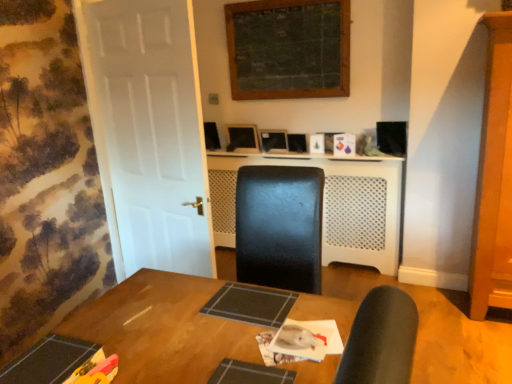
Question: From the image's perspective, is white perforated plastic at center under matte black monitor at center?

Choices:
 (A) yes
 (B) no

Answer: (A)

Question: From the image's perspective, is white perforated plastic at center on top of matte black monitor at center?

Choices:
 (A) yes
 (B) no

Answer: (B)

Question: Does white perforated plastic at center contain matte black monitor at center?

Choices:
 (A) no
 (B) yes

Answer: (A)

Question: Can you confirm if white perforated plastic at center is thinner than matte black monitor at center?

Choices:
 (A) yes
 (B) no

Answer: (B)

Question: Does white perforated plastic at center have a larger size compared to matte black monitor at center?

Choices:
 (A) no
 (B) yes

Answer: (B)

Question: Relative to white matte door at left, is matte black monitor at center in front or behind?

Choices:
 (A) front
 (B) behind

Answer: (B)

Question: Considering the positions of matte black monitor at center and white matte door at left in the image, is matte black monitor at center bigger or smaller than white matte door at left?

Choices:
 (A) small
 (B) big

Answer: (A)

Question: Is matte black monitor at center wider or thinner than white matte door at left?

Choices:
 (A) wide
 (B) thin

Answer: (B)

Question: Is point (247, 127) positioned closer to the camera than point (142, 137)?

Choices:
 (A) closer
 (B) farther

Answer: (B)

Question: Does point pos(181,44) appear closer or farther from the camera than point pos(92,334)?

Choices:
 (A) farther
 (B) closer

Answer: (A)

Question: From the image's perspective, is white matte door at left located above or below wooden table at center?

Choices:
 (A) below
 (B) above

Answer: (B)

Question: Looking at the image, does white matte door at left seem bigger or smaller compared to wooden table at center?

Choices:
 (A) big
 (B) small

Answer: (A)

Question: Would you say white matte door at left is to the left or to the right of wooden table at center in the picture?

Choices:
 (A) right
 (B) left

Answer: (B)

Question: In the image, is matte black monitor at center positioned in front of or behind white perforated plastic at center?

Choices:
 (A) behind
 (B) front

Answer: (A)

Question: Is matte black monitor at center inside or outside of white perforated plastic at center?

Choices:
 (A) inside
 (B) outside

Answer: (B)